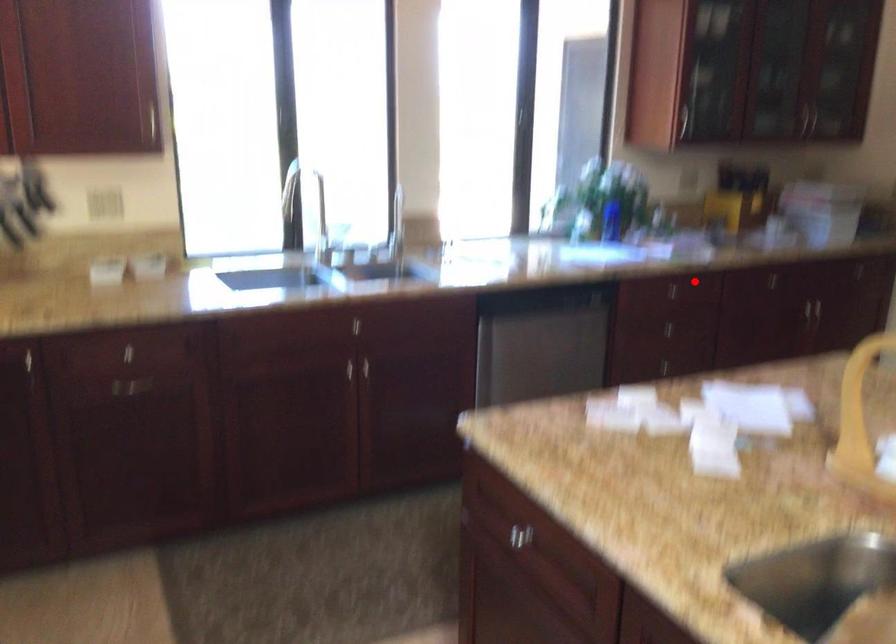
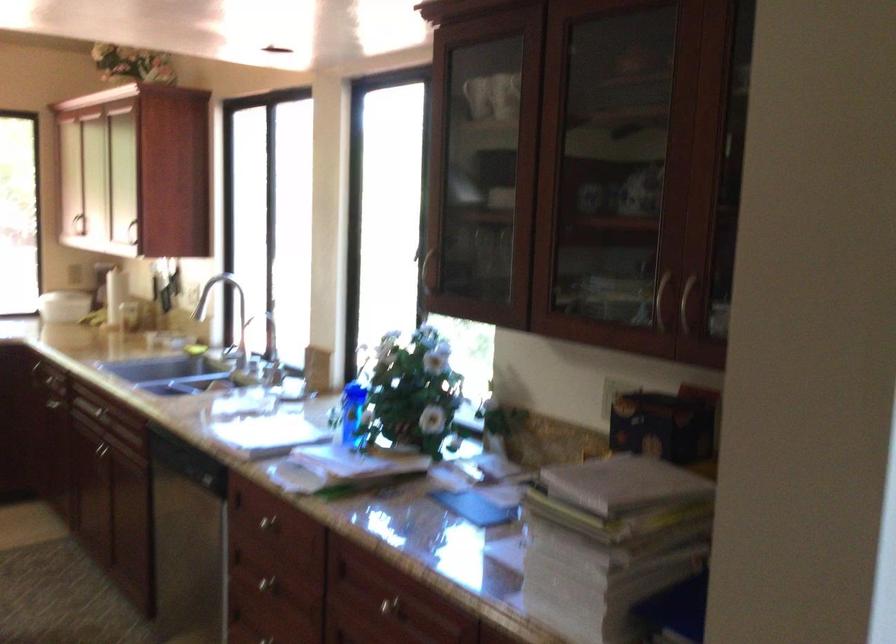
The point at the highlighted location is marked in the first image. Where is the corresponding point in the second image?

(268, 522)